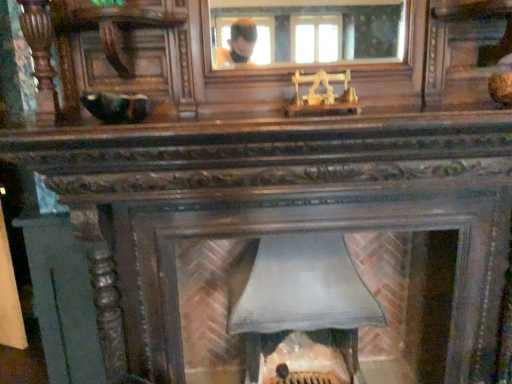
Question: From the image's perspective, is smooth gray stone fireplace at center below clear glass mirror at upper center?

Choices:
 (A) yes
 (B) no

Answer: (A)

Question: Considering the relative sizes of smooth gray stone fireplace at center and clear glass mirror at upper center in the image provided, is smooth gray stone fireplace at center wider than clear glass mirror at upper center?

Choices:
 (A) yes
 (B) no

Answer: (A)

Question: Is smooth gray stone fireplace at center placed right next to clear glass mirror at upper center?

Choices:
 (A) yes
 (B) no

Answer: (B)

Question: Does smooth gray stone fireplace at center have a smaller size compared to clear glass mirror at upper center?

Choices:
 (A) yes
 (B) no

Answer: (B)

Question: From a real-world perspective, is smooth gray stone fireplace at center physically above clear glass mirror at upper center?

Choices:
 (A) yes
 (B) no

Answer: (B)

Question: Is smooth gray stone fireplace at center thinner than clear glass mirror at upper center?

Choices:
 (A) yes
 (B) no

Answer: (B)

Question: Are clear glass mirror at upper center and smooth gray stone fireplace at center located far from each other?

Choices:
 (A) no
 (B) yes

Answer: (B)

Question: Considering the relative sizes of clear glass mirror at upper center and smooth gray stone fireplace at center in the image provided, is clear glass mirror at upper center thinner than smooth gray stone fireplace at center?

Choices:
 (A) yes
 (B) no

Answer: (A)

Question: Considering the relative sizes of clear glass mirror at upper center and smooth gray stone fireplace at center in the image provided, is clear glass mirror at upper center taller than smooth gray stone fireplace at center?

Choices:
 (A) yes
 (B) no

Answer: (B)

Question: Could you tell me if clear glass mirror at upper center is turned towards smooth gray stone fireplace at center?

Choices:
 (A) no
 (B) yes

Answer: (A)

Question: Would you say clear glass mirror at upper center contains smooth gray stone fireplace at center?

Choices:
 (A) yes
 (B) no

Answer: (B)

Question: From a real-world perspective, is clear glass mirror at upper center physically above smooth gray stone fireplace at center?

Choices:
 (A) yes
 (B) no

Answer: (A)

Question: Considering their positions, is smooth gray stone fireplace at center located in front of or behind clear glass mirror at upper center?

Choices:
 (A) front
 (B) behind

Answer: (B)